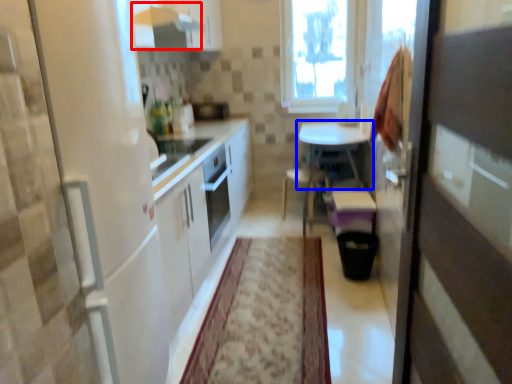
Question: Which object appears closest to the camera in this image, exhaust hood (highlighted by a red box) or table (highlighted by a blue box)?

Choices:
 (A) exhaust hood
 (B) table

Answer: (A)